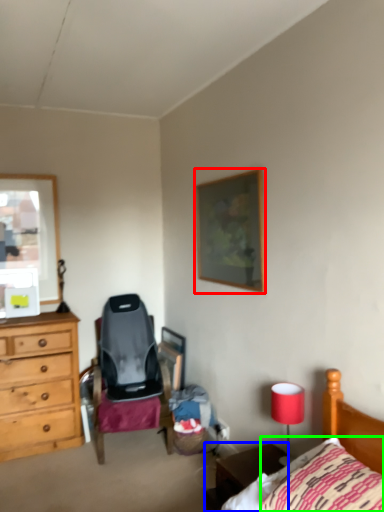
Question: Based on their relative distances, which object is nearer to picture frame (highlighted by a red box)? Choose from nightstand (highlighted by a blue box) and pillow (highlighted by a green box).

Choices:
 (A) nightstand
 (B) pillow

Answer: (A)